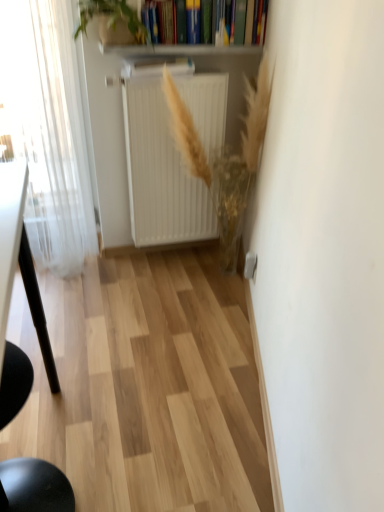
Question: Is white matte radiator at center outside of white sheer curtain at left?

Choices:
 (A) yes
 (B) no

Answer: (A)

Question: Considering the relative sizes of white matte radiator at center and white sheer curtain at left in the image provided, is white matte radiator at center taller than white sheer curtain at left?

Choices:
 (A) yes
 (B) no

Answer: (B)

Question: Is white matte radiator at center smaller than white sheer curtain at left?

Choices:
 (A) no
 (B) yes

Answer: (B)

Question: Is white matte radiator at center bigger than white sheer curtain at left?

Choices:
 (A) no
 (B) yes

Answer: (A)

Question: Is white matte radiator at center closer to the viewer compared to white sheer curtain at left?

Choices:
 (A) yes
 (B) no

Answer: (B)

Question: Considering the positions of white matte radiator at center and white glossy radiator at upper center in the image, is white matte radiator at center bigger or smaller than white glossy radiator at upper center?

Choices:
 (A) big
 (B) small

Answer: (A)

Question: Considering the positions of point click(x=135, y=108) and point click(x=125, y=48), is point click(x=135, y=108) closer or farther from the camera than point click(x=125, y=48)?

Choices:
 (A) farther
 (B) closer

Answer: (A)

Question: Which is correct: white matte radiator at center is inside white glossy radiator at upper center, or outside of it?

Choices:
 (A) inside
 (B) outside

Answer: (B)

Question: Considering the relative positions of white matte radiator at center and white glossy radiator at upper center in the image provided, is white matte radiator at center to the left or to the right of white glossy radiator at upper center?

Choices:
 (A) right
 (B) left

Answer: (B)

Question: From the image's perspective, is white sheer curtain at left located above or below white matte radiator at center?

Choices:
 (A) below
 (B) above

Answer: (B)

Question: Is white sheer curtain at left inside or outside of white matte radiator at center?

Choices:
 (A) outside
 (B) inside

Answer: (A)

Question: In terms of size, does white sheer curtain at left appear bigger or smaller than white matte radiator at center?

Choices:
 (A) small
 (B) big

Answer: (B)

Question: From a real-world perspective, is white sheer curtain at left above or below white matte radiator at center?

Choices:
 (A) below
 (B) above

Answer: (B)

Question: Does point (188, 130) appear closer or farther from the camera than point (102, 2)?

Choices:
 (A) closer
 (B) farther

Answer: (B)

Question: From a real-world perspective, is golden textured plant at center, acting as the first plant starting from the right, positioned above or below green leafy plant at upper center, the first plant positioned from the left?

Choices:
 (A) below
 (B) above

Answer: (A)